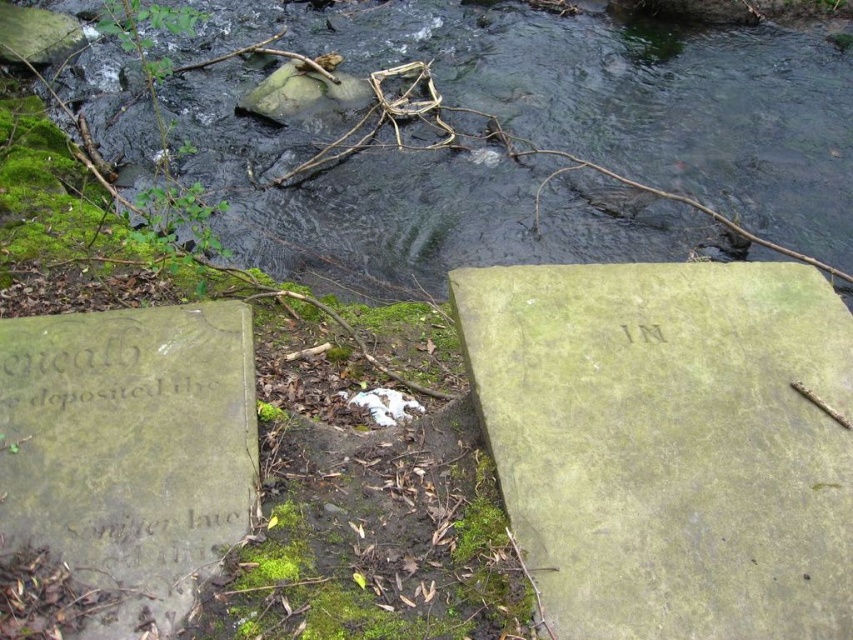
You are standing at the center of the stream and want to place a small marker at the exact location of the green mossy rock at upper center. What are the coordinates where you should place the marker?

The coordinates for the green mossy rock at upper center are 0.155 on the x axis and 0.727 on the y axis.

You are standing at the edge of the stream and see the green mossy rock at upper center. If you want to reach it without getting your shoes wet, what is the minimum distance you need to walk?

The green mossy rock at upper center is 5.66 meters away from you, so you need to walk at least 5.66 meters to reach it without getting your shoes wet.

You are standing in the mossy area near the stream and want to place a small marker between the two points, point (248, 262) and point (74, 330). Which point should the marker be closer to if you want it to be closer to the camera?

The marker should be closer to point (248, 262) because it is further to the camera than point (74, 330).